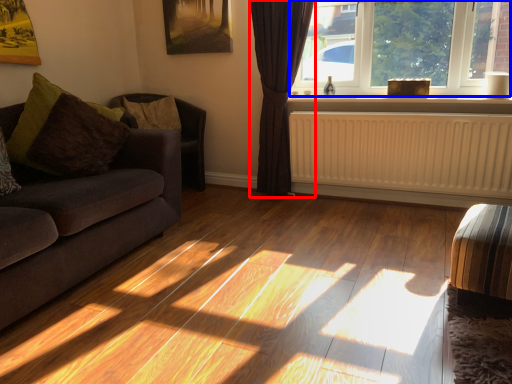
Question: Which of the following is the farthest to the observer, curtain (highlighted by a red box) or window (highlighted by a blue box)?

Choices:
 (A) curtain
 (B) window

Answer: (A)